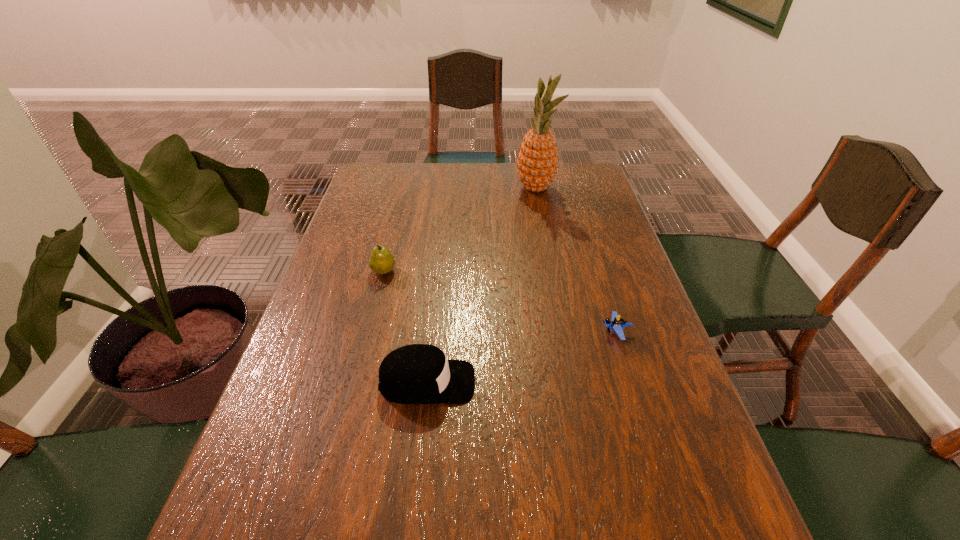
Where is `free space between the leftmost object and the farthest object`? free space between the leftmost object and the farthest object is located at coordinates (460, 230).

Locate an element on the screen. unoccupied area between the second object from right to left and the pear is located at coordinates (460, 230).

You are a GUI agent. You are given a task and a screenshot of the screen. Output one action in this format:
    pyautogui.click(x=<x>, y=<y>)
    Task: Click on the free space between the second object from right to left and the leftmost object
    
    Given the screenshot: What is the action you would take?
    pyautogui.click(x=460, y=230)

Locate an element on the screen. This screenshot has width=960, height=540. object that ranks as the closest to the pineapple is located at coordinates (381, 261).

Find the location of a particular element. the second closest object to the third object from left to right is located at coordinates (616, 324).